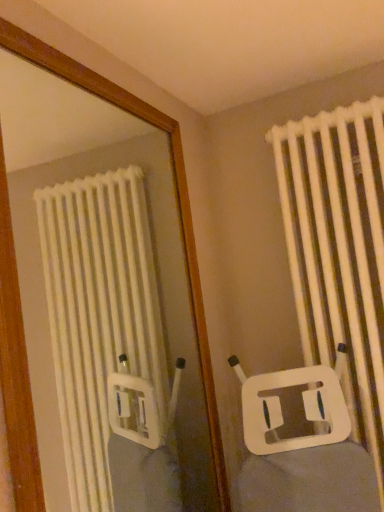
Question: In the image, is white plastic mirror at upper center positioned in front of or behind white plastic radiator at right?

Choices:
 (A) behind
 (B) front

Answer: (B)

Question: From their relative heights in the image, would you say white plastic mirror at upper center is taller or shorter than white plastic radiator at right?

Choices:
 (A) short
 (B) tall

Answer: (A)

Question: From a real-world perspective, is white plastic mirror at upper center positioned above or below white plastic radiator at right?

Choices:
 (A) above
 (B) below

Answer: (A)

Question: Would you say white plastic radiator at right is to the left or to the right of white plastic mirror at upper center in the picture?

Choices:
 (A) left
 (B) right

Answer: (B)

Question: Is point (297, 272) closer or farther from the camera than point (24, 326)?

Choices:
 (A) closer
 (B) farther

Answer: (A)

Question: From the image's perspective, relative to white plastic mirror at upper center, is white plastic radiator at right above or below?

Choices:
 (A) above
 (B) below

Answer: (A)

Question: Considering their positions, is white plastic radiator at right located in front of or behind white plastic mirror at upper center?

Choices:
 (A) behind
 (B) front

Answer: (A)